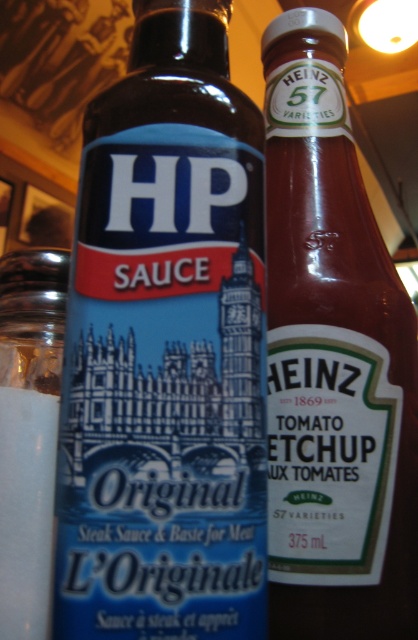
You are setting up a table for a barbecue and need to place the matte plastic hp sauce at left and the clear glass salt shaker at left. Which item should you place first to the leftmost position?

The clear glass salt shaker at left should be placed first to the leftmost position because the matte plastic hp sauce at left is positioned on the right side of it.

You are setting up a picnic table and want to place the matte glass bottle of ketchup at center and the clear glass salt shaker at left on a small shelf. The shelf is only 10 cm deep. Can both items fit on the shelf if the bottle is placed in front of the salt shaker?

The matte glass bottle of ketchup at center is positioned over the clear glass salt shaker at left, meaning it is placed in front of it. Since the shelf is 10 cm deep, the combined depth of both items must be within this limit. However, the description only states their positional relationship, not their individual depths. Without knowing the exact depth of each item, it is impossible to determine if they will fit on the 10 cm deep shelf.